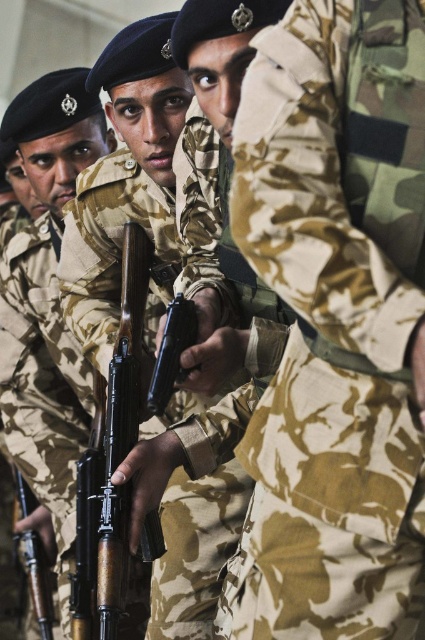
Who is positioned more to the right, camouflage fabric uniform at center or camouflage fabric rifle at center?

camouflage fabric uniform at center is more to the right.

Describe the element at coordinates (334, 324) in the screenshot. The image size is (425, 640). I see `camouflage fabric uniform at center` at that location.

The image size is (425, 640). Describe the element at coordinates (334, 324) in the screenshot. I see `camouflage fabric uniform at center` at that location.

Locate an element on the screen. camouflage fabric uniform at center is located at coordinates (334, 324).

In the scene shown: Measure the distance between point [68,586] and camera.

A distance of 9.10 feet exists between point [68,586] and camera.

Can you confirm if camouflage fabric rifle at center is bigger than matte brown rifle at lower left?

Yes.

Locate an element on the screen. camouflage fabric rifle at center is located at coordinates (42, 381).

The width and height of the screenshot is (425, 640). In order to click on camouflage fabric rifle at center in this screenshot , I will do `click(42, 381)`.

Consider the image. Does camouflage fabric uniform at center have a smaller size compared to matte brown rifle at lower left?

No, camouflage fabric uniform at center is not smaller than matte brown rifle at lower left.

Does camouflage fabric uniform at center appear under matte brown rifle at lower left?

No.

Find the location of a particular element. camouflage fabric uniform at center is located at coordinates (334, 324).

Identify the location of camouflage fabric uniform at center. (334, 324).